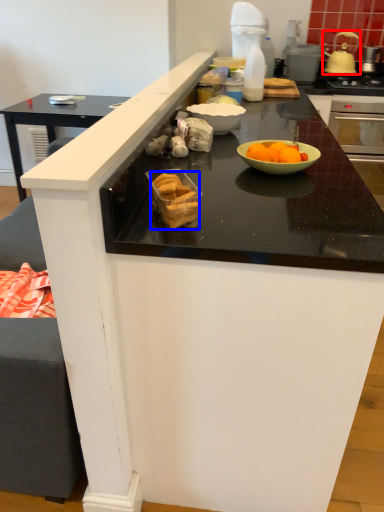
Question: Which object is further to the camera taking this photo, kitchen appliance (highlighted by a red box) or food (highlighted by a blue box)?

Choices:
 (A) kitchen appliance
 (B) food

Answer: (A)